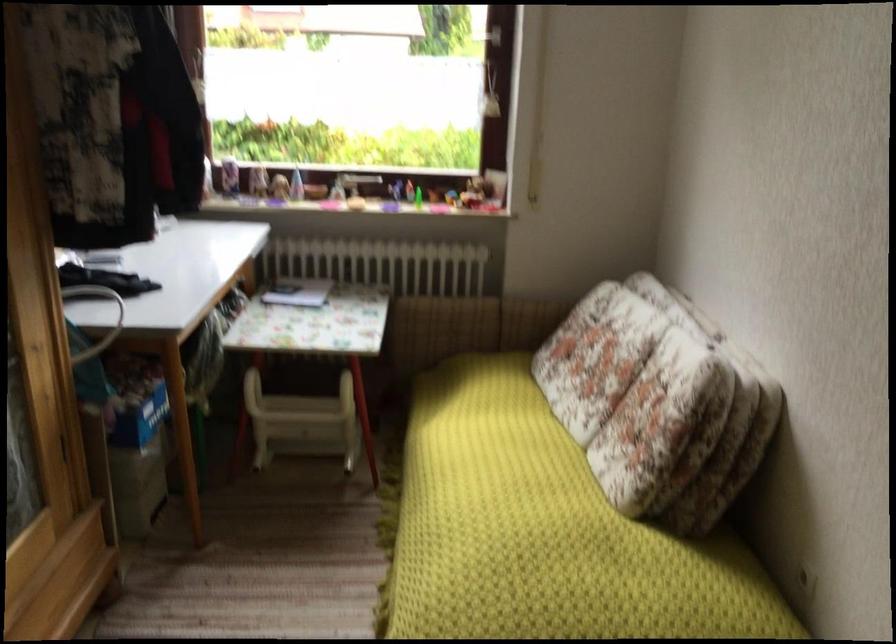
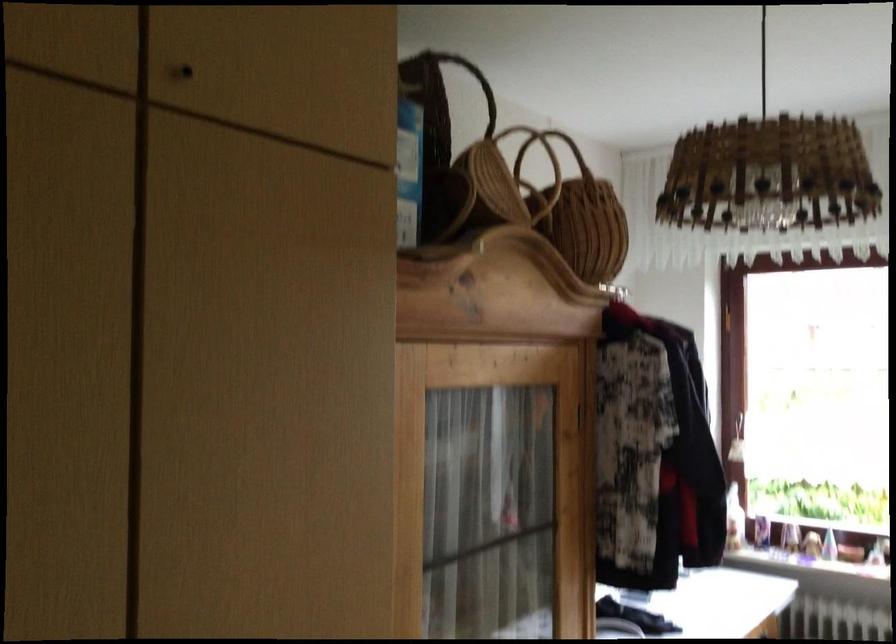
Based on the continuous images, in which direction is the camera rotating?

The camera's rotation is toward left-up.